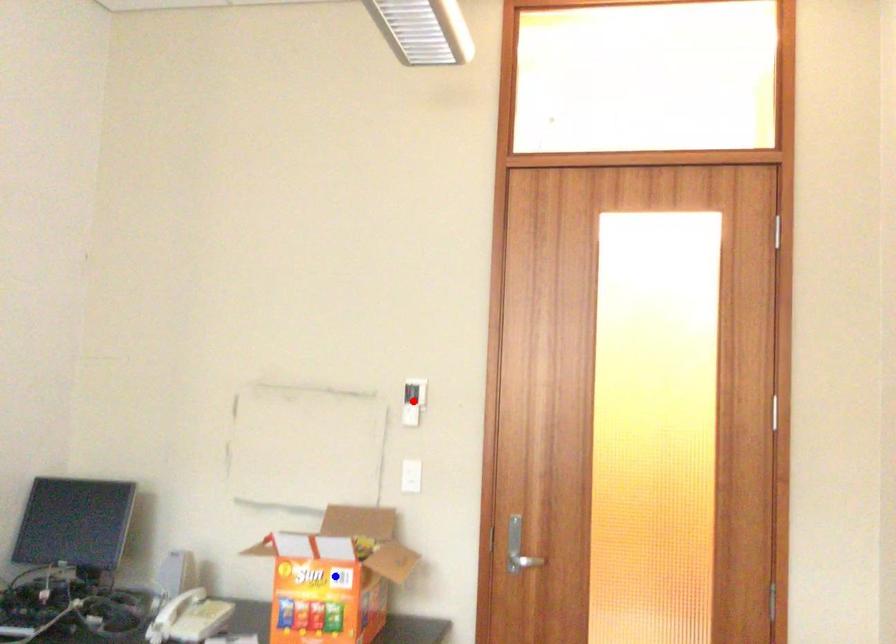
Question: Two points are marked on the image. Which point is closer to the camera?

Choices:
 (A) Blue point is closer.
 (B) Red point is closer.

Answer: (A)